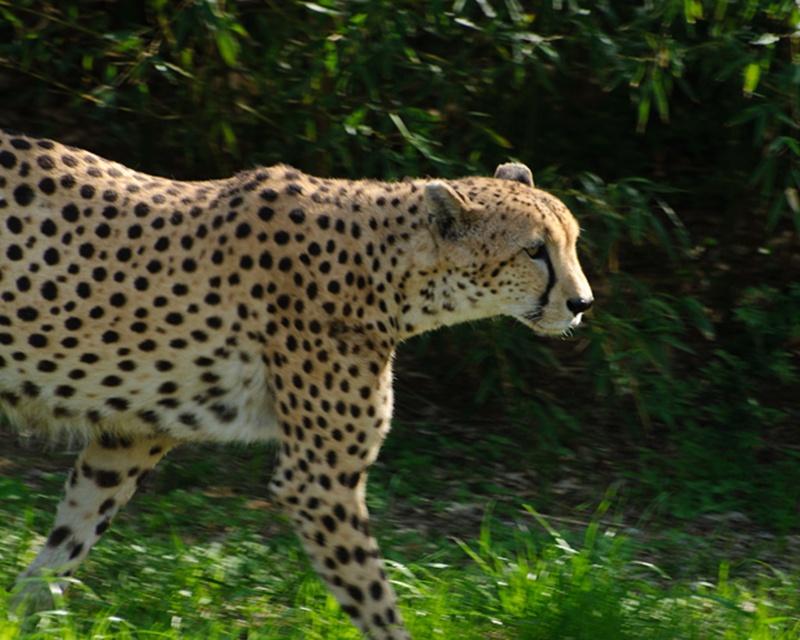
Question: From the image, what is the correct spatial relationship of spotted fur cheetah at center in relation to green grass at lower center?

Choices:
 (A) left
 (B) right

Answer: (A)

Question: Which point is closer to the camera?

Choices:
 (A) (188, 376)
 (B) (664, 545)

Answer: (A)

Question: Among these objects, which one is farthest from the camera?

Choices:
 (A) spotted fur cheetah at center
 (B) green grass at lower center

Answer: (B)

Question: Can you confirm if spotted fur cheetah at center is positioned to the right of green grass at lower center?

Choices:
 (A) yes
 (B) no

Answer: (B)

Question: Which point is closer to the camera taking this photo?

Choices:
 (A) (130, 307)
 (B) (233, 630)

Answer: (A)

Question: Observing the image, what is the correct spatial positioning of spotted fur cheetah at center in reference to green grass at lower center?

Choices:
 (A) left
 (B) right

Answer: (A)